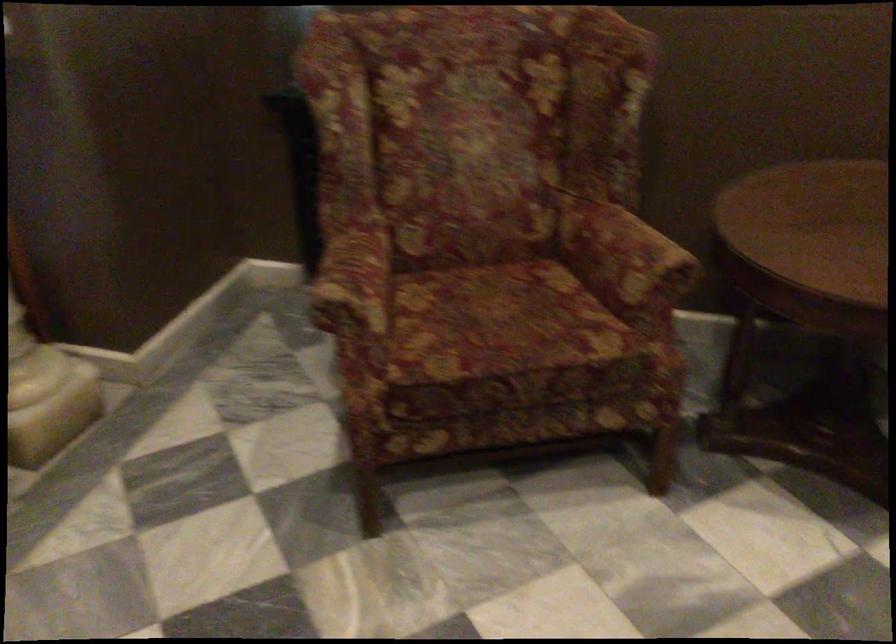
Image resolution: width=896 pixels, height=644 pixels. What do you see at coordinates (501, 323) in the screenshot?
I see `a chair sitting surface` at bounding box center [501, 323].